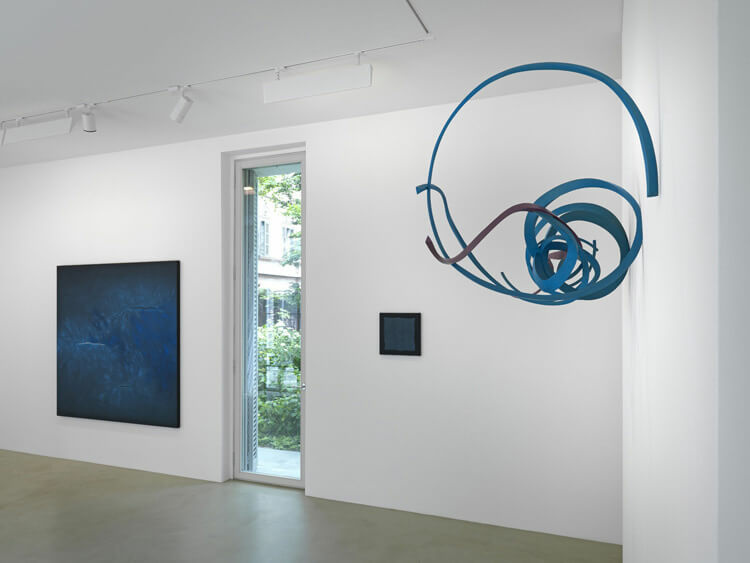
Identify the location of wall. (384, 413).